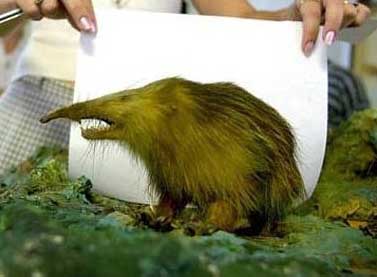
Find the location of `pen`. pen is located at coordinates (13, 14).